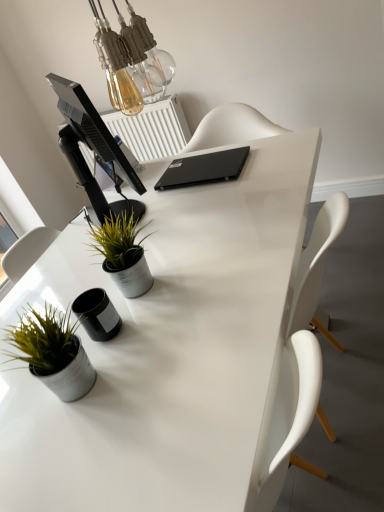
Find the location of a particular element. white plastic radiator at upper center is located at coordinates (150, 131).

Image resolution: width=384 pixels, height=512 pixels. What do you see at coordinates (52, 351) in the screenshot?
I see `matte gray pot at lower left, which is counted as the first houseplant, starting from the bottom` at bounding box center [52, 351].

At what (x,y) coordinates should I click in order to perform the action: click on white glossy desk at center. Please return your answer as a coordinate pair (x, y). Looking at the image, I should click on coord(175,354).

I want to click on black glossy monitor at upper left, so click(x=92, y=147).

Is matte gray pot at lower left, marked as the first houseplant in a front-to-back arrangement, directly adjacent to metallic gray pot at center, placed as the 1th houseplant when sorted from top to bottom?

No, matte gray pot at lower left, marked as the first houseplant in a front-to-back arrangement, is not making contact with metallic gray pot at center, placed as the 1th houseplant when sorted from top to bottom.

Between matte gray pot at lower left, marked as the 2th houseplant in a back-to-front arrangement, and metallic gray pot at center, placed as the 1th houseplant when sorted from top to bottom, which one has smaller width?

With smaller width is matte gray pot at lower left, marked as the 2th houseplant in a back-to-front arrangement.

Is matte gray pot at lower left, marked as the 2th houseplant in a back-to-front arrangement, aimed at metallic gray pot at center, marked as the 1th houseplant in a back-to-front arrangement?

No.

From a real-world perspective, which object stands above the other?

matte gray pot at lower left, marked as the first houseplant in a front-to-back arrangement, from a real-world perspective.

Is white glossy desk at center positioned before metallic gray pot at center, the second houseplant positioned from the front?

Yes, white glossy desk at center is closer to the viewer.

Can you confirm if white glossy desk at center is positioned to the right of metallic gray pot at center, which is counted as the second houseplant, starting from the bottom?

Indeed, white glossy desk at center is positioned on the right side of metallic gray pot at center, which is counted as the second houseplant, starting from the bottom.

Locate an element on the screen. The image size is (384, 512). desk below the metallic gray pot at center, marked as the 1th houseplant in a back-to-front arrangement (from a real-world perspective) is located at coordinates (175, 354).

Is white glossy desk at center inside or outside of metallic gray pot at center, which is counted as the second houseplant, starting from the bottom?

white glossy desk at center is not inside metallic gray pot at center, which is counted as the second houseplant, starting from the bottom, it's outside.

In the scene shown: Does black matte laptop at center touch black glossy monitor at upper left?

There is a gap between black matte laptop at center and black glossy monitor at upper left.

Which of these two, black matte laptop at center or black glossy monitor at upper left, is bigger?

black glossy monitor at upper left is bigger.

Is black matte laptop at center positioned with its back to black glossy monitor at upper left?

No, black matte laptop at center is not facing away from black glossy monitor at upper left.

From a real-world perspective, is white glossy desk at center located higher than black glossy monitor at upper left?

No, from a real-world perspective, white glossy desk at center is not on top of black glossy monitor at upper left.

Is white glossy desk at center outside of black glossy monitor at upper left?

Yes.

I want to click on desk below the black glossy monitor at upper left (from a real-world perspective), so click(x=175, y=354).

Can you tell me how much white plastic radiator at upper center and black glossy monitor at upper left differ in facing direction?

134 degrees.

Considering the relative positions of white plastic radiator at upper center and black glossy monitor at upper left in the image provided, is white plastic radiator at upper center to the left of black glossy monitor at upper left from the viewer's perspective?

Correct, you'll find white plastic radiator at upper center to the left of black glossy monitor at upper left.

Is white plastic radiator at upper center next to black glossy monitor at upper left and touching it?

No, white plastic radiator at upper center is not next to black glossy monitor at upper left.

Between white plastic radiator at upper center and black glossy monitor at upper left, which one is positioned behind?

white plastic radiator at upper center.

Looking at this image, which object is thinner, white plastic radiator at upper center or white glossy desk at center?

Thinner between the two is white plastic radiator at upper center.

Which object is positioned more to the right, white plastic radiator at upper center or white glossy desk at center?

white glossy desk at center is more to the right.

Considering the points (85, 158) and (42, 273), which point is behind, point (85, 158) or point (42, 273)?

Point (85, 158)

Measure the distance from white plastic radiator at upper center to white glossy desk at center.

The distance of white plastic radiator at upper center from white glossy desk at center is 4.20 feet.

Between point (227, 193) and point (14, 336), which one is positioned in front?

Positioned in front is point (14, 336).

Is white glossy desk at center facing away from matte gray pot at lower left, which is counted as the first houseplant, starting from the bottom?

No, matte gray pot at lower left, which is counted as the first houseplant, starting from the bottom, is not at the back of white glossy desk at center.

Visually, is white glossy desk at center positioned to the left or to the right of matte gray pot at lower left, marked as the first houseplant in a front-to-back arrangement?

white glossy desk at center is to the right of matte gray pot at lower left, marked as the first houseplant in a front-to-back arrangement.

Consider the image. Which of these two, white glossy desk at center or matte gray pot at lower left, which is counted as the first houseplant, starting from the bottom, is wider?

Wider between the two is white glossy desk at center.

Where is `houseplant above the metallic gray pot at center, which is counted as the second houseplant, starting from the bottom (from a real-world perspective)`? The height and width of the screenshot is (512, 384). houseplant above the metallic gray pot at center, which is counted as the second houseplant, starting from the bottom (from a real-world perspective) is located at coordinates (52, 351).

This screenshot has width=384, height=512. Identify the location of desk in front of the metallic gray pot at center, marked as the 1th houseplant in a back-to-front arrangement. (175, 354).

Looking at the image, which one is located further to matte gray pot at lower left, marked as the 2th houseplant in a back-to-front arrangement, white glossy desk at center or white plastic radiator at upper center?

The object further to matte gray pot at lower left, marked as the 2th houseplant in a back-to-front arrangement, is white plastic radiator at upper center.

Estimate the real-world distances between objects in this image. Which object is closer to black matte laptop at center, white plastic radiator at upper center or white glossy desk at center?

white glossy desk at center.

When comparing their distances from white plastic radiator at upper center, does black matte laptop at center or white glossy desk at center seem closer?

black matte laptop at center.

When comparing their distances from metallic gray pot at center, marked as the 1th houseplant in a back-to-front arrangement, does white glossy desk at center or black glossy monitor at upper left seem further?

Among the two, white glossy desk at center is located further to metallic gray pot at center, marked as the 1th houseplant in a back-to-front arrangement.

From the image, which object appears to be farther from black glossy monitor at upper left, black matte laptop at center or white glossy desk at center?

The object further to black glossy monitor at upper left is white glossy desk at center.

Looking at the image, which one is located further to matte gray pot at lower left, which is counted as the first houseplant, starting from the bottom, black glossy monitor at upper left or black matte laptop at center?

black matte laptop at center lies further to matte gray pot at lower left, which is counted as the first houseplant, starting from the bottom, than the other object.

When comparing their distances from white glossy desk at center, does black glossy monitor at upper left or black matte laptop at center seem closer?

black glossy monitor at upper left lies closer to white glossy desk at center than the other object.

Estimate the real-world distances between objects in this image. Which object is further from black glossy monitor at upper left, matte gray pot at lower left, which is the 2th houseplant from top to bottom, or white plastic radiator at upper center?

Based on the image, white plastic radiator at upper center appears to be further to black glossy monitor at upper left.

Where is `computer monitor between white glossy desk at center and white plastic radiator at upper center in the front-back direction`? computer monitor between white glossy desk at center and white plastic radiator at upper center in the front-back direction is located at coordinates (92, 147).

The height and width of the screenshot is (512, 384). Find the location of `laptop located between black glossy monitor at upper left and white plastic radiator at upper center in the depth direction`. laptop located between black glossy monitor at upper left and white plastic radiator at upper center in the depth direction is located at coordinates (203, 169).

Find the location of a particular element. The height and width of the screenshot is (512, 384). laptop located between white glossy desk at center and white plastic radiator at upper center in the depth direction is located at coordinates (203, 169).

Locate an element on the screen. The width and height of the screenshot is (384, 512). houseplant located between white glossy desk at center and metallic gray pot at center, the second houseplant positioned from the front, in the depth direction is located at coordinates (52, 351).